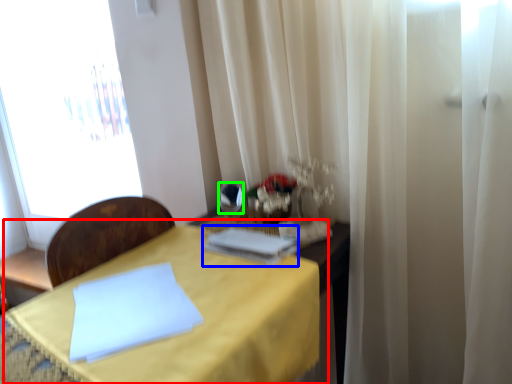
Question: Which object is positioned farthest from table (highlighted by a red box)? Select from book (highlighted by a blue box) and mirror (highlighted by a green box).

Choices:
 (A) book
 (B) mirror

Answer: (B)